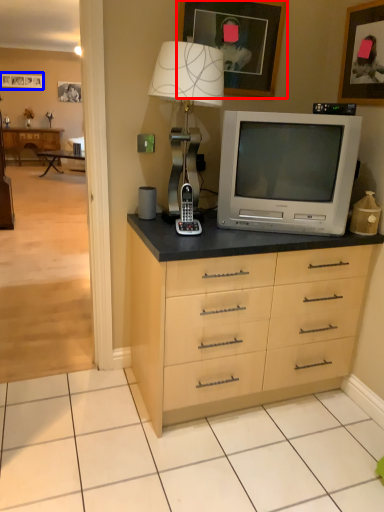
Question: Which point is closer to the camera, picture frame (highlighted by a red box) or picture frame (highlighted by a blue box)?

Choices:
 (A) picture frame
 (B) picture frame

Answer: (A)